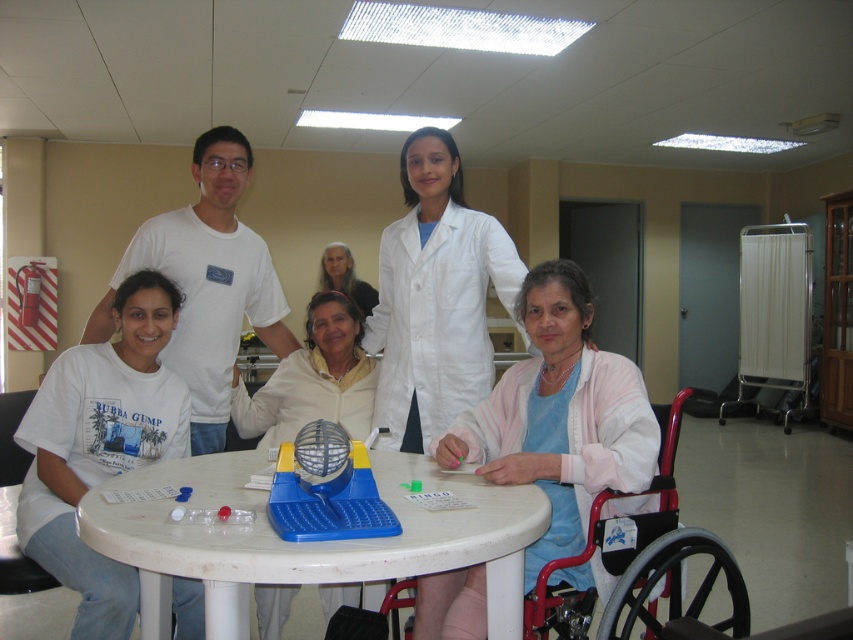
Which is behind, point (218, 566) or point (334, 260)?

Positioned behind is point (334, 260).

Between white plastic table at center and smooth white hair at upper center, which one appears on the left side from the viewer's perspective?

smooth white hair at upper center is more to the left.

Who is more forward, (167, 499) or (340, 259)?

Point (167, 499)

At what (x,y) coordinates should I click in order to perform the action: click on white plastic table at center. Please return your answer as a coordinate pair (x, y). The height and width of the screenshot is (640, 853). Looking at the image, I should click on (308, 541).

Is white plastic table at center taller than pink fabric at center?

Incorrect, white plastic table at center's height is not larger of pink fabric at center's.

Can you confirm if white plastic table at center is thinner than pink fabric at center?

No, white plastic table at center is not thinner than pink fabric at center.

Which is behind, point (219, 534) or point (592, 563)?

The point (592, 563) is more distant.

I want to click on white plastic table at center, so click(x=308, y=541).

Between point (483, 442) and point (370, 381), which one is positioned in front?

Point (483, 442)

At what (x,y) coordinates should I click in order to perform the action: click on pink fabric at center. Please return your answer as a coordinate pair (x, y). Looking at the image, I should click on (560, 416).